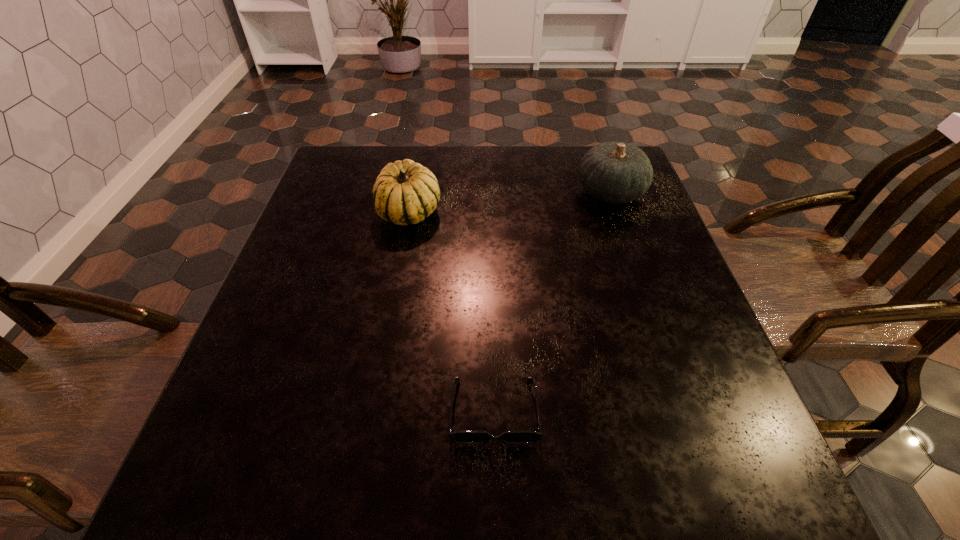
Where is `vacant region at the near edge of the desktop`? The height and width of the screenshot is (540, 960). vacant region at the near edge of the desktop is located at coordinates (623, 455).

This screenshot has height=540, width=960. In order to click on blank space at the left edge in this screenshot , I will do `click(351, 246)`.

You are a GUI agent. You are given a task and a screenshot of the screen. Output one action in this format:
    pyautogui.click(x=<x>, y=<y>)
    Task: Click on the vacant space at the right edge
    This screenshot has height=540, width=960.
    Given the screenshot: What is the action you would take?
    pyautogui.click(x=627, y=240)

Where is `vacant space at the far left corner of the desktop`? vacant space at the far left corner of the desktop is located at coordinates (334, 185).

This screenshot has height=540, width=960. In the image, there is a desktop. In order to click on free space at the near left corner in this screenshot , I will do `click(214, 485)`.

This screenshot has height=540, width=960. What are the coordinates of `vacant space at the far right corner` in the screenshot? It's located at 577,163.

Identify the location of free space between the leftmost object and the right gourd. The width and height of the screenshot is (960, 540). (510, 202).

You are a GUI agent. You are given a task and a screenshot of the screen. Output one action in this format:
    pyautogui.click(x=<x>, y=<y>)
    Task: Click on the empty space that is in between the rightmost object and the leftmost object
    
    Given the screenshot: What is the action you would take?
    pyautogui.click(x=510, y=202)

The height and width of the screenshot is (540, 960). I want to click on free spot between the right gourd and the shortest object, so click(552, 302).

In order to click on free area in between the second object from right to left and the left gourd in this screenshot , I will do `click(451, 311)`.